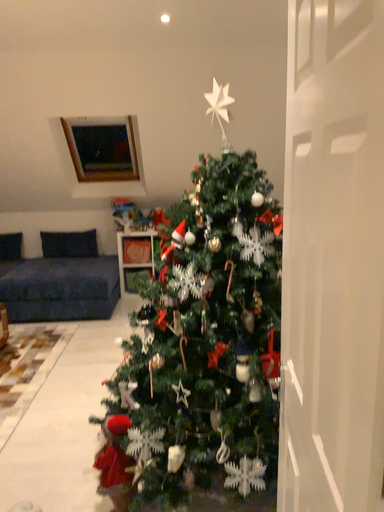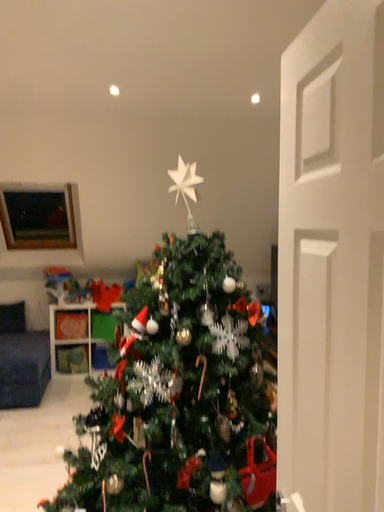
Question: How did the camera likely rotate when shooting the video?

Choices:
 (A) rotated downward
 (B) rotated upward

Answer: (B)